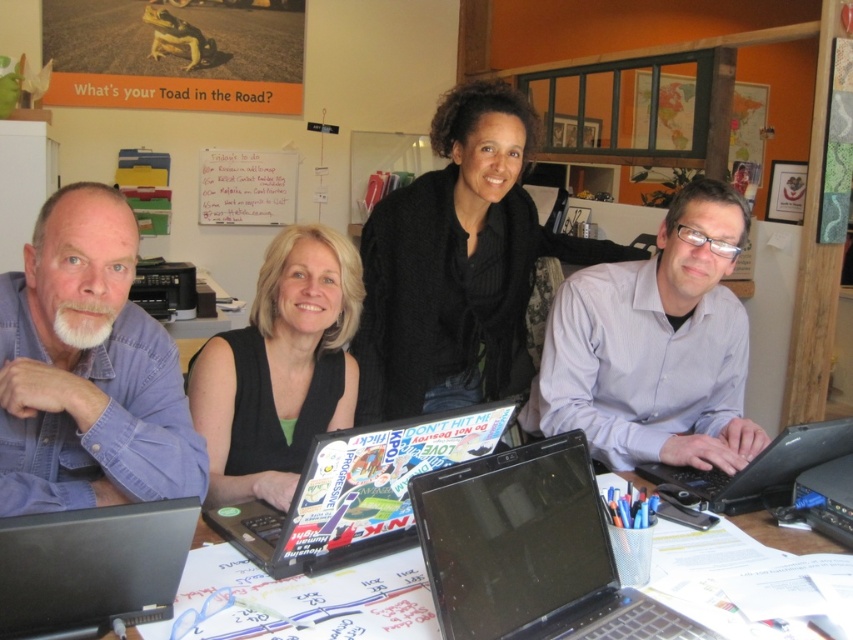
Question: Which of the following is the closest to the observer?

Choices:
 (A) tap(383, 476)
 (B) tap(816, 532)
 (C) tap(254, 385)
 (D) tap(515, 484)

Answer: (D)

Question: Which object is positioned closest to the black knitwear at center?

Choices:
 (A) black plastic laptop at lower right
 (B) blue denim shirt at left
 (C) whiteboard at upper left

Answer: (B)

Question: Which of the following is the farthest from the observer?

Choices:
 (A) black glossy laptop at center
 (B) blue denim shirt at left
 (C) white paper at center

Answer: (C)

Question: Is blue denim shirt at left bigger than shiny black laptop at center?

Choices:
 (A) yes
 (B) no

Answer: (B)

Question: Does blue denim shirt at left appear on the left side of black matte shirt at center?

Choices:
 (A) no
 (B) yes

Answer: (B)

Question: Is black knitwear at center further to the viewer compared to black matte shirt at center?

Choices:
 (A) yes
 (B) no

Answer: (A)